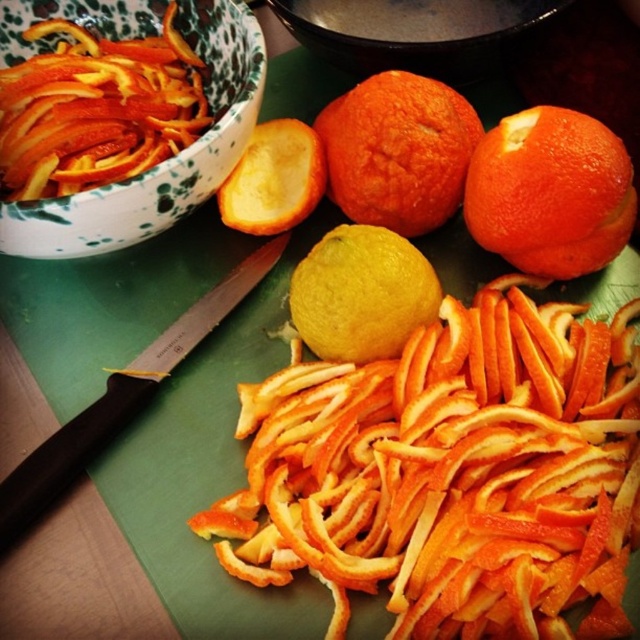
You are organizing a citrus arrangement for a presentation. You have a white speckled ceramic bowl at upper left and a matte ceramic bowl at upper center. According to the image, which bowl should you place on the right side to follow the existing layout?

The matte ceramic bowl at upper center should be placed on the right side since it is already positioned to the right of the white speckled ceramic bowl at upper left in the image.

You are a chef trying to arrange two points on a cutting board. You have point at coordinates point [561,200] and point at coordinates point [429,54]. Which point is closer to you as you stand in front of the cutting board?

Point at coordinates point [561,200] is closer to the viewer than point at coordinates point [429,54].

You are a chef preparing a dish and need to place the orange matte at center on top of the white speckled ceramic bowl at upper left. Can you do this without moving any other items?

The white speckled ceramic bowl at upper left is closer to the viewer than the orange matte at center, meaning the bowl is physically in front of the orange matte. To place the orange matte on top of the bowl, you would need to move the bowl or other items blocking access, so it is not possible without moving other items.